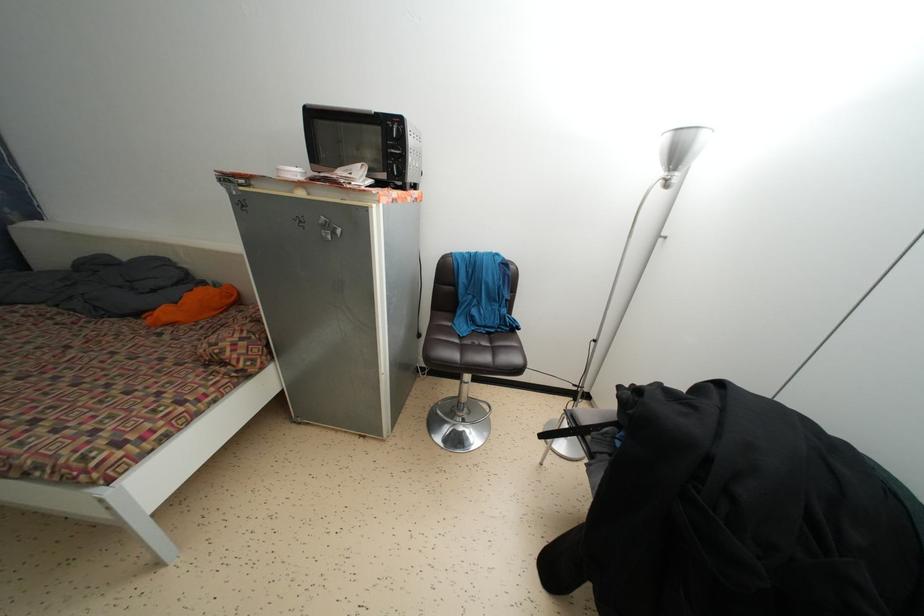
Find where to sit the brown chair sitting surface. Please return your answer as a coordinate pair (x, y).

(470, 350)